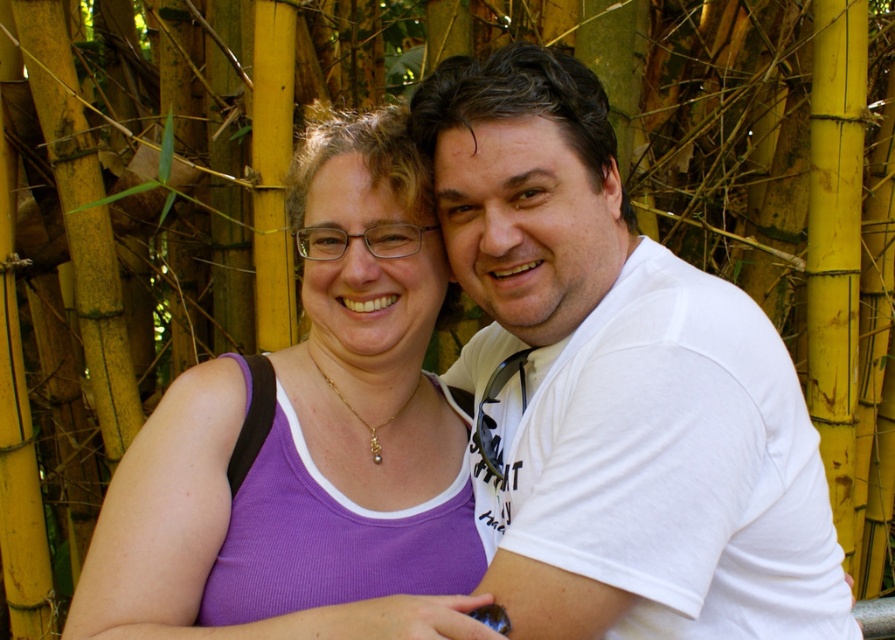
You are a photographer trying to capture a clear shot of both the white cotton shirt at center and the purple fabric tank top at center. Since the bamboo stalks are dense in the background, you need to adjust your camera angle to avoid them. Which clothing item should you focus on first to ensure it stays visible in the frame?

The white cotton shirt at center has a greater height compared to the purple fabric tank top at center. Therefore, focusing on the white cotton shirt at center first will ensure it remains visible as it is taller and less likely to be obscured by the bamboo stalks in the background.

You are a photographer adjusting the focus on your camera. You want to ensure both the white cotton shirt at center and the purple fabric tank top at center are in focus. Which one should you focus on first to achieve this?

You should focus on the white cotton shirt at center first because it is closer to the viewer than the purple fabric tank top at center. By focusing on the closer object, the farther one will also be in focus due to the depth of field.

In the scene shown: You are a photographer who wants to ensure that both the white cotton shirt at center and the purple fabric tank top at center are clearly visible in your photo. Since the bamboo stalks are dense, you need to adjust your position. Which direction should you move to avoid the bamboo stalks blocking the view between these two items of clothing?

Move to the left so that the bamboo stalks no longer block the view between the white cotton shirt at center and the purple fabric tank top at center, as the white cotton shirt at center is to the right of the purple fabric tank top at center.